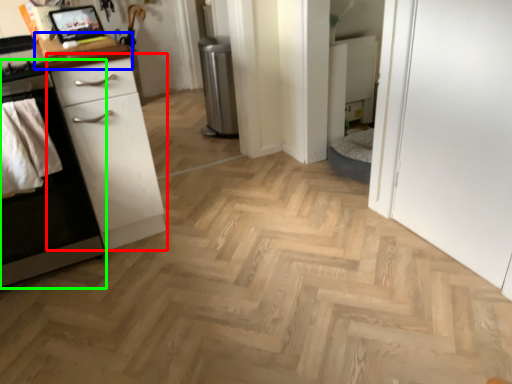
Question: Which object is positioned closest to chest of drawers (highlighted by a red box)? Select from counter top (highlighted by a blue box) and cabinetry (highlighted by a green box).

Choices:
 (A) counter top
 (B) cabinetry

Answer: (B)